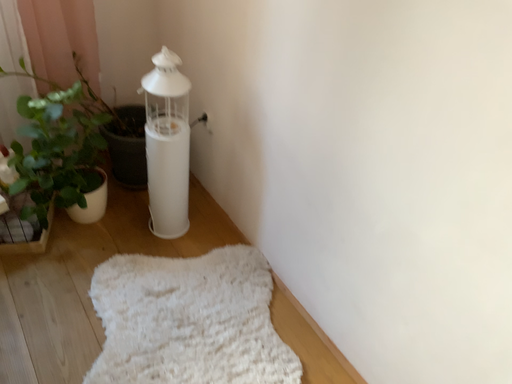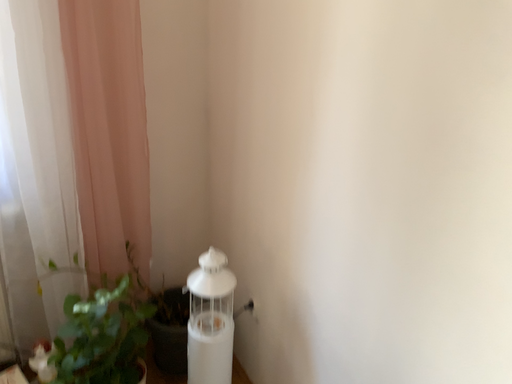
Question: How did the camera likely rotate when shooting the video?

Choices:
 (A) rotated downward
 (B) rotated upward

Answer: (B)